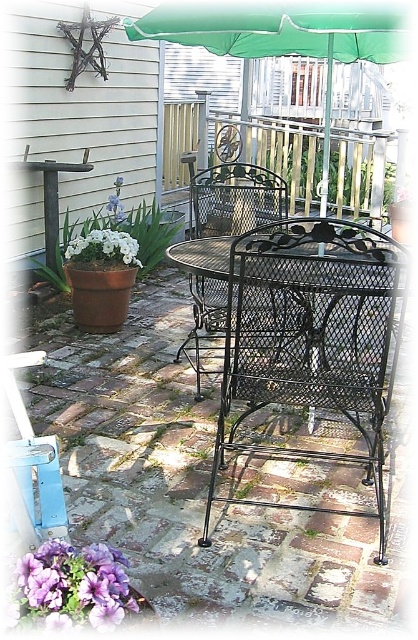
You are standing at the entrance of the patio and want to sit down. The black wrought iron chair at center is your target. Based on its coordinates, is it closer to the entrance or the far wall?

The black wrought iron chair at center is located at point (313, 339), which places it closer to the entrance than the far wall since the coordinates are closer to the entrance area.

You are a painter standing on the ground and want to paint the black wrought iron chair at center and the purple petal at lower left. Which object will require you to look up more?

The black wrought iron chair at center is much taller than the purple petal at lower left, so you will need to look up more to paint the black wrought iron chair at center.

You are standing on the patio and want to place a small potted plant between the green fabric umbrella at upper center and the purple petal at lower left. Based on their positions, which object should the plant be closer to?

The green fabric umbrella at upper center is to the right of the purple petal at lower left, so the plant should be placed closer to the purple petal at lower left to be between them.